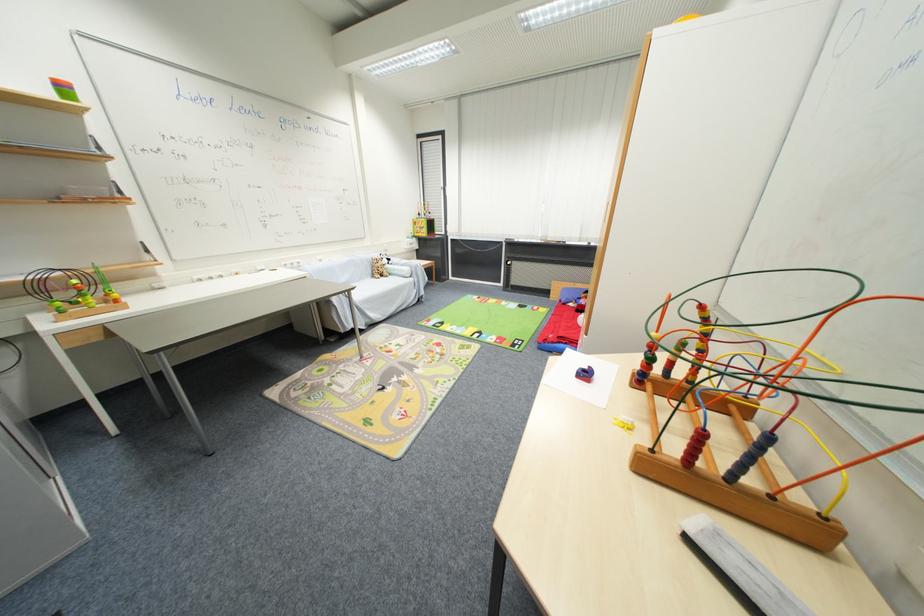
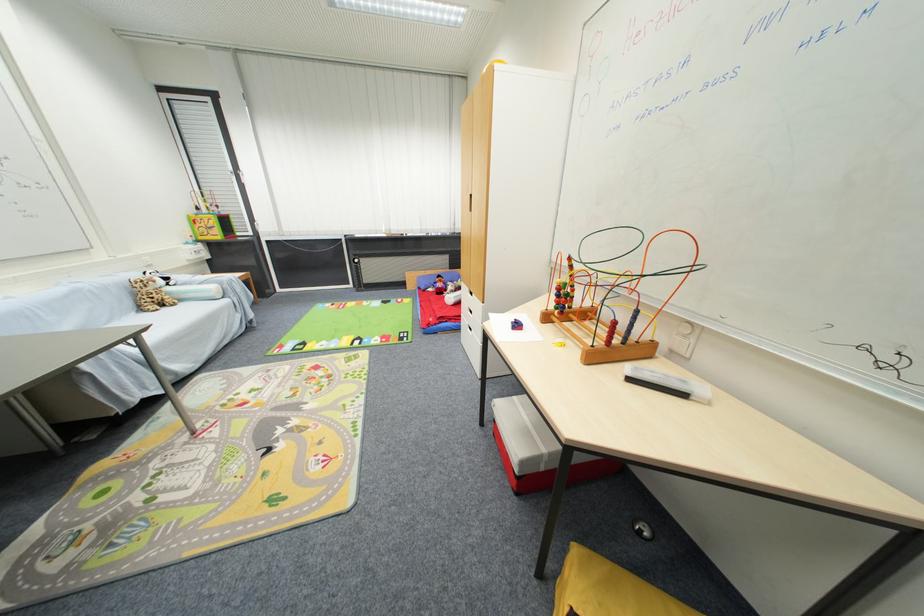
In the second image, find the point that corresponds to (x=411, y=270) in the first image.

(217, 290)